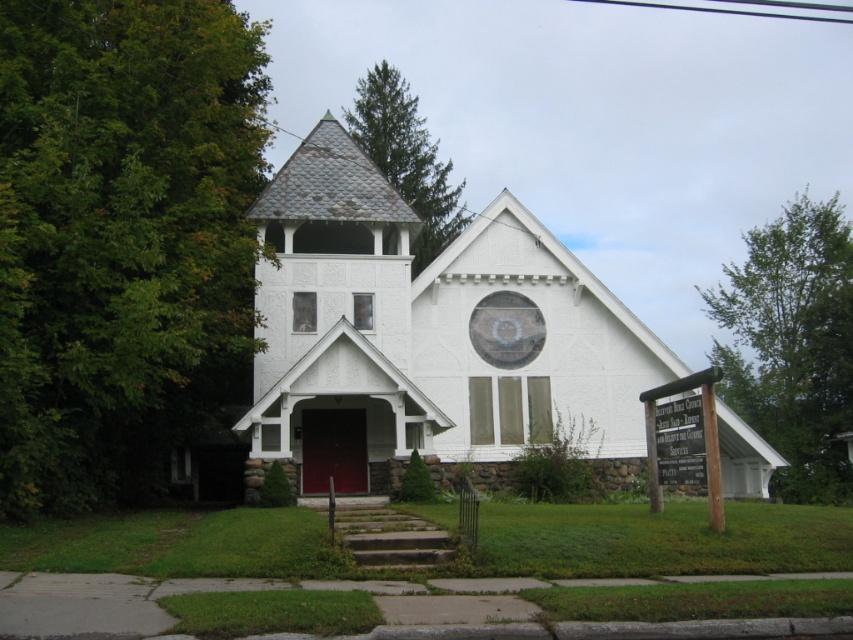
You are standing at the front of the church and want to determine which tree has a larger width between the green leafy tree at upper right and the green textured pine tree at upper center. Based on the view from your current position, which tree is wider?

The green leafy tree at upper right might be wider than green textured pine tree at upper center.

You are standing in front of the church and notice two trees in the background. Which tree is closer to you, the green leafy tree at upper right or the green textured pine tree at upper center?

The green leafy tree at upper right is closer to you because the green textured pine tree at upper center is positioned behind it.